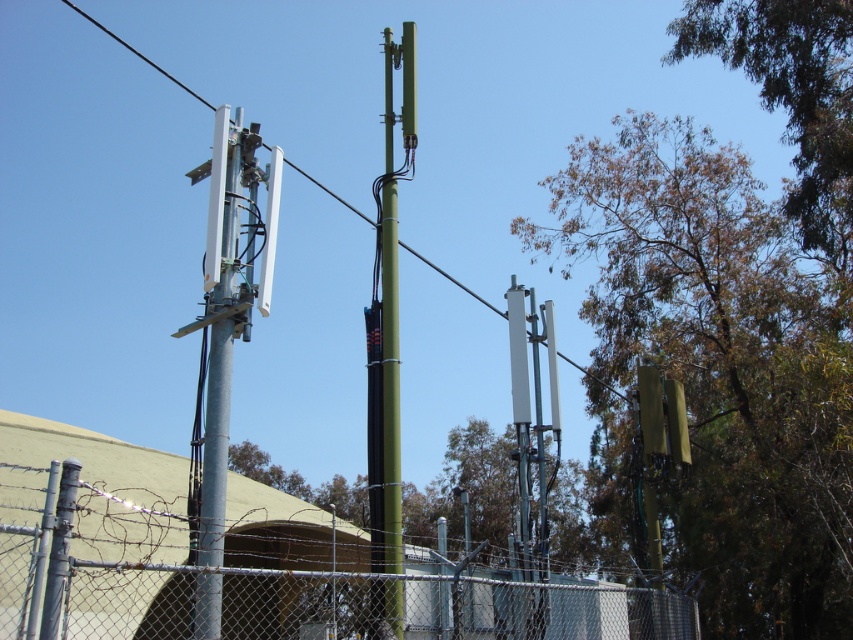
Who is more forward, (305, 580) or (647, 435)?

Point (305, 580)

How far apart are metal chain-link fence at lower center and metallic green traffic light at right?

metal chain-link fence at lower center and metallic green traffic light at right are 4.27 meters apart from each other.

Locate an element on the screen. This screenshot has height=640, width=853. metal chain-link fence at lower center is located at coordinates (444, 605).

Who is higher up, green matte/rough telegraph pole at center or metallic green traffic light at right?

green matte/rough telegraph pole at center

Is point (376, 456) farther from viewer compared to point (688, 436)?

No, it is not.

This screenshot has height=640, width=853. What are the coordinates of `green matte/rough telegraph pole at center` in the screenshot? It's located at (392, 294).

Is metallic gray pole at left further to camera compared to green matte pole at center?

No, metallic gray pole at left is in front of green matte pole at center.

Which is above, metallic gray pole at left or green matte pole at center?

Positioned higher is green matte pole at center.

Does point (209, 273) lie in front of point (426, 262)?

Yes, point (209, 273) is in front of point (426, 262).

Locate an element on the screen. metallic gray pole at left is located at coordinates (221, 317).